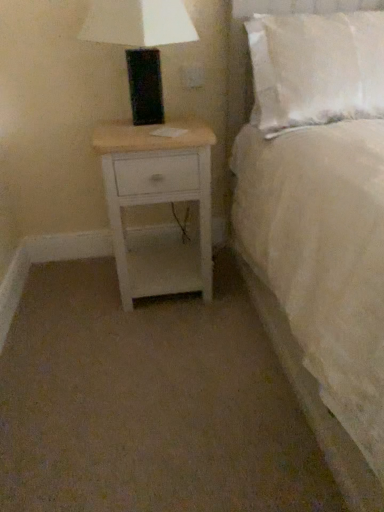
Question: Is white soft bed at upper right positioned beyond the bounds of white soft pillow at upper right?

Choices:
 (A) no
 (B) yes

Answer: (B)

Question: Can you confirm if white soft bed at upper right is taller than white soft pillow at upper right?

Choices:
 (A) no
 (B) yes

Answer: (B)

Question: Are white soft bed at upper right and white soft pillow at upper right beside each other?

Choices:
 (A) yes
 (B) no

Answer: (B)

Question: Can you confirm if white soft bed at upper right is positioned to the left of white soft pillow at upper right?

Choices:
 (A) yes
 (B) no

Answer: (A)

Question: Is white soft bed at upper right positioned with its back to white soft pillow at upper right?

Choices:
 (A) no
 (B) yes

Answer: (B)

Question: Considering the positions of white plastic outlet at upper center and white soft bed at upper right in the image, is white plastic outlet at upper center wider or thinner than white soft bed at upper right?

Choices:
 (A) thin
 (B) wide

Answer: (A)

Question: From the image's perspective, relative to white soft bed at upper right, is white plastic outlet at upper center above or below?

Choices:
 (A) above
 (B) below

Answer: (A)

Question: Is point (182, 81) positioned closer to the camera than point (306, 401)?

Choices:
 (A) farther
 (B) closer

Answer: (A)

Question: In terms of size, does white plastic outlet at upper center appear bigger or smaller than white soft bed at upper right?

Choices:
 (A) small
 (B) big

Answer: (A)

Question: Is matte black lamp at upper left spatially inside white plastic outlet at upper center, or outside of it?

Choices:
 (A) outside
 (B) inside

Answer: (A)

Question: Visually, is matte black lamp at upper left positioned to the left or to the right of white plastic outlet at upper center?

Choices:
 (A) left
 (B) right

Answer: (A)

Question: From the image's perspective, is matte black lamp at upper left located above or below white plastic outlet at upper center?

Choices:
 (A) below
 (B) above

Answer: (A)

Question: From a real-world perspective, is matte black lamp at upper left positioned above or below white plastic outlet at upper center?

Choices:
 (A) below
 (B) above

Answer: (B)

Question: Is matte black lamp at upper left wider or thinner than white soft pillow at upper right?

Choices:
 (A) thin
 (B) wide

Answer: (A)

Question: Visually, is matte black lamp at upper left positioned to the left or to the right of white soft pillow at upper right?

Choices:
 (A) right
 (B) left

Answer: (B)